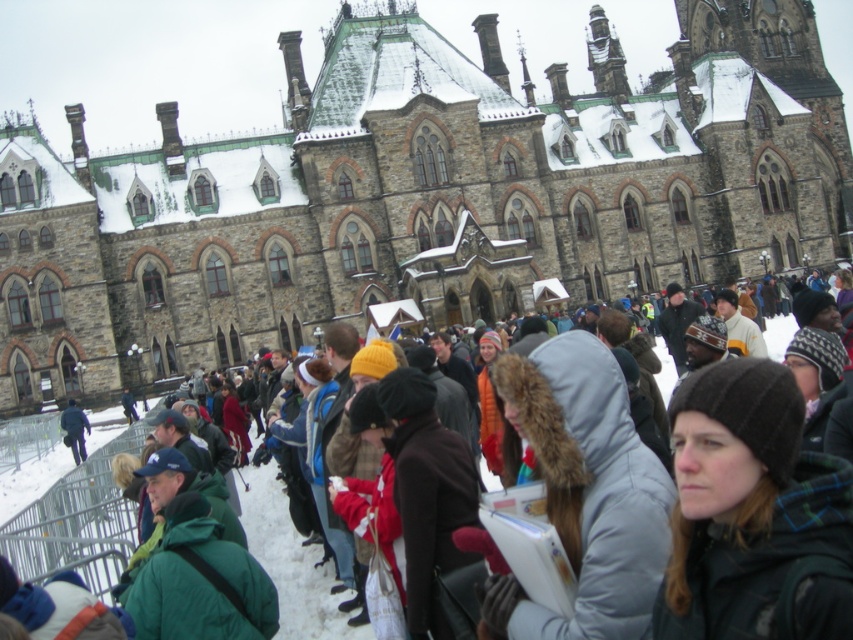
Question: Among these objects, which one is nearest to the camera?

Choices:
 (A) dark blue jacket at center
 (B) stone church at center

Answer: (A)

Question: Is stone church at center to the left of dark blue jacket at center from the viewer's perspective?

Choices:
 (A) yes
 (B) no

Answer: (B)

Question: Does stone church at center have a lesser width compared to dark blue jacket at center?

Choices:
 (A) no
 (B) yes

Answer: (A)

Question: Which object is farther from the camera taking this photo?

Choices:
 (A) dark blue jacket at center
 (B) stone church at center

Answer: (B)

Question: Does stone church at center come behind dark blue jacket at center?

Choices:
 (A) yes
 (B) no

Answer: (A)